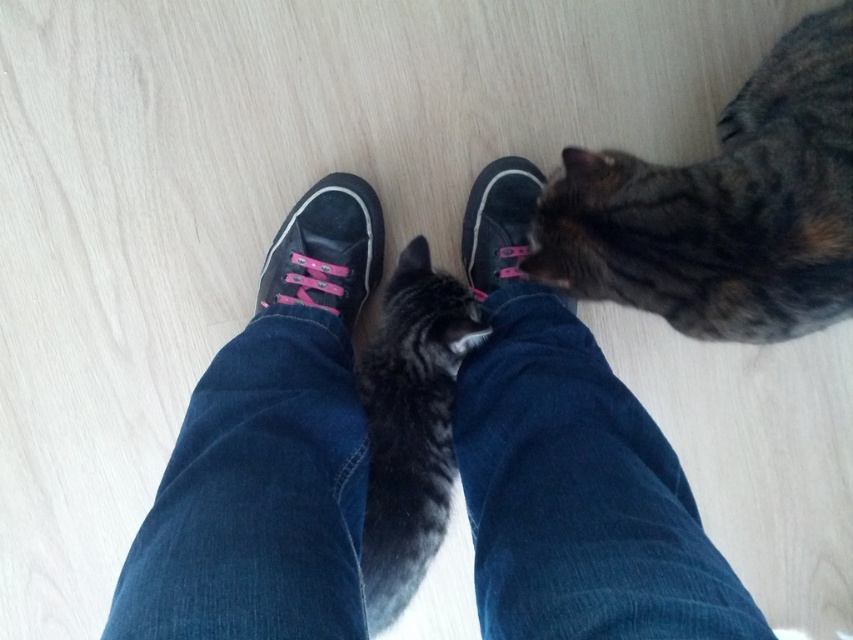
You are a photographer trying to capture a candid shot of the cats interacting with the feet. You want to ensure the denim pants at center and the black canvas shoe at center are both in focus. Which object should you focus on first to ensure both are sharp in the photo?

The denim pants at center is taller than the black canvas shoe at center. Since the denim pants at center is taller, focusing on it first will help ensure both are in focus as it is the larger subject.

You are a photographer taking a picture of the denim pants at center and the black canvas shoe at center. Which object should you focus on first if you want to capture both clearly in the same frame?

The denim pants at center is closer to the viewer than the black canvas shoe at center, so you should focus on the denim pants at center first to ensure both are in focus.